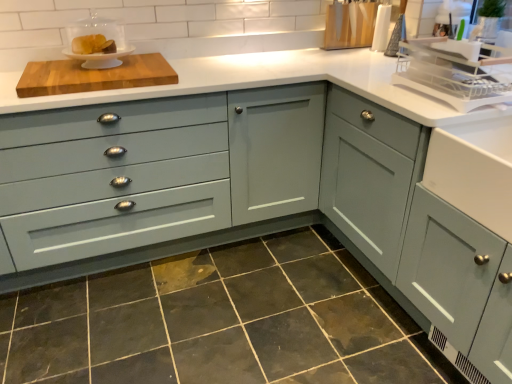
At what (x,y) coordinates should I click in order to perform the action: click on free point above wooden knife block at upper right, the second appliance from the left (from a real-world perspective). Please return your answer as a coordinate pair (x, y). The image size is (512, 384). Looking at the image, I should click on (347, 6).